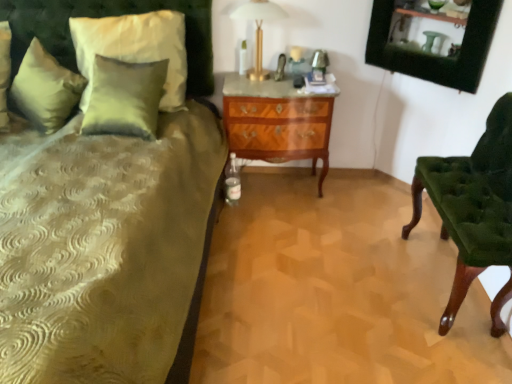
This screenshot has height=384, width=512. Identify the location of velvet green chair at right. (473, 209).

Is point (65, 8) in front of point (288, 110)?

No, it is not.

Considering the relative sizes of velvet green headboard at upper left and mahogany wood drawer at center in the image provided, is velvet green headboard at upper left shorter than mahogany wood drawer at center?

Yes.

Does velvet green headboard at upper left have a lesser width compared to mahogany wood drawer at center?

Correct, the width of velvet green headboard at upper left is less than that of mahogany wood drawer at center.

In the image, there is a velvet green headboard at upper left. Where is `nightstand below it (from the image's perspective)`? This screenshot has width=512, height=384. nightstand below it (from the image's perspective) is located at coordinates (276, 123).

In the image, there is a satin green pillow at upper left, the 2th pillow viewed from the right. Find the location of `chair below it (from a real-world perspective)`. chair below it (from a real-world perspective) is located at coordinates (473, 209).

Is velvet green chair at right outside of satin green pillow at upper left, acting as the first pillow starting from the left?

Yes, velvet green chair at right is outside of satin green pillow at upper left, acting as the first pillow starting from the left.

From the image's perspective, is velvet green chair at right above or below satin green pillow at upper left, the 2th pillow viewed from the right?

Clearly, from the image's perspective, velvet green chair at right is below satin green pillow at upper left, the 2th pillow viewed from the right.

In terms of height, does velvet green chair at right look taller or shorter compared to satin green pillow at upper left, acting as the first pillow starting from the left?

Clearly, velvet green chair at right is taller compared to satin green pillow at upper left, acting as the first pillow starting from the left.

Locate an element on the screen. The height and width of the screenshot is (384, 512). the 1st pillow below the gold metallic table lamp at upper center (from the image's perspective) is located at coordinates (45, 89).

Is point (264, 8) positioned in front of point (20, 108)?

No.

Can you confirm if gold metallic table lamp at upper center is taller than satin green pillow at upper left, acting as the first pillow starting from the left?

Indeed, gold metallic table lamp at upper center has a greater height compared to satin green pillow at upper left, acting as the first pillow starting from the left.

Considering the positions of objects gold metallic table lamp at upper center and satin green pillow at upper left, the 2th pillow viewed from the right, in the image provided, who is behind, gold metallic table lamp at upper center or satin green pillow at upper left, the 2th pillow viewed from the right,?

gold metallic table lamp at upper center is behind.

Is satin green pillow at upper left, acting as the first pillow starting from the left, in contact with gold metallic table lamp at upper center?

satin green pillow at upper left, acting as the first pillow starting from the left, is not next to gold metallic table lamp at upper center, and they're not touching.

Between satin green pillow at upper left, the 2th pillow viewed from the right, and gold metallic table lamp at upper center, which one has smaller size?

gold metallic table lamp at upper center.

From a real-world perspective, is satin green pillow at upper left, the 2th pillow viewed from the right, physically located above or below gold metallic table lamp at upper center?

In terms of real-world spatial position, satin green pillow at upper left, the 2th pillow viewed from the right, is below gold metallic table lamp at upper center.

Is satin green pillow at upper left, acting as the first pillow starting from the left, positioned beyond the bounds of gold metallic table lamp at upper center?

That's correct, satin green pillow at upper left, acting as the first pillow starting from the left, is outside of gold metallic table lamp at upper center.

From a real-world perspective, is gold metallic table lamp at upper center located higher than satin green pillow at upper left, the 1th pillow when ordered from right to left?

Correct, in the physical world, gold metallic table lamp at upper center is higher than satin green pillow at upper left, the 1th pillow when ordered from right to left.

Is point (255, 53) positioned in front of point (153, 42)?

No, it is behind (153, 42).

Between gold metallic table lamp at upper center and satin green pillow at upper left, placed as the second pillow when sorted from left to right, which one has larger width?

gold metallic table lamp at upper center.

Is gold metallic table lamp at upper center outside of satin green pillow at upper left, the 1th pillow when ordered from right to left?

gold metallic table lamp at upper center is positioned outside satin green pillow at upper left, the 1th pillow when ordered from right to left.

From the image's perspective, would you say mahogany wood drawer at center is positioned over velvet green chair at right?

Correct, mahogany wood drawer at center appears higher than velvet green chair at right in the image.

Considering the relative sizes of mahogany wood drawer at center and velvet green chair at right in the image provided, is mahogany wood drawer at center thinner than velvet green chair at right?

No.

Would you say mahogany wood drawer at center is to the left or to the right of velvet green chair at right in the picture?

In the image, mahogany wood drawer at center appears on the left side of velvet green chair at right.

Relative to velvet green chair at right, is mahogany wood drawer at center in front or behind?

Visually, mahogany wood drawer at center is located behind velvet green chair at right.

Considering the points (15, 73) and (38, 46), which point is in front, point (15, 73) or point (38, 46)?

The point (38, 46) is closer to the camera.

Would you say velvet green headboard at upper left contains satin green pillow at upper left, acting as the first pillow starting from the left?

No, satin green pillow at upper left, acting as the first pillow starting from the left, is not surrounded by velvet green headboard at upper left.

Is velvet green headboard at upper left aimed at satin green pillow at upper left, the 2th pillow viewed from the right?

No, velvet green headboard at upper left is not aimed at satin green pillow at upper left, the 2th pillow viewed from the right.

In the scene shown: From the image's perspective, which one is positioned higher, velvet green headboard at upper left or satin green pillow at upper left, acting as the first pillow starting from the left?

From the image's view, velvet green headboard at upper left is above.

The image size is (512, 384). In the image, there is a velvet green headboard at upper left. Find the location of `nightstand below it (from a real-world perspective)`. nightstand below it (from a real-world perspective) is located at coordinates (276, 123).

Starting from the velvet green chair at right, which pillow is the 2nd one to the left? Please provide its 2D coordinates.

[(45, 89)]

Looking at the image, which one is located closer to gold metallic table lamp at upper center, velvet green chair at right or satin green pillow at upper left, the 1th pillow when ordered from right to left?

satin green pillow at upper left, the 1th pillow when ordered from right to left, is closer to gold metallic table lamp at upper center.

Looking at the image, which one is located further to velvet green chair at right, mahogany wood drawer at center or satin green pillow at upper left, acting as the first pillow starting from the left?

satin green pillow at upper left, acting as the first pillow starting from the left, lies further to velvet green chair at right than the other object.

Which object lies nearer to the anchor point velvet green headboard at upper left, satin green pillow at upper left, the 1th pillow when ordered from right to left, or satin green pillow at upper left, acting as the first pillow starting from the left?

satin green pillow at upper left, the 1th pillow when ordered from right to left, lies closer to velvet green headboard at upper left than the other object.

Considering their positions, is velvet green chair at right positioned further to satin green pillow at upper left, acting as the first pillow starting from the left, than velvet green headboard at upper left?

Among the two, velvet green chair at right is located further to satin green pillow at upper left, acting as the first pillow starting from the left.

When comparing their distances from velvet green chair at right, does satin green pillow at upper left, placed as the second pillow when sorted from left to right, or gold metallic table lamp at upper center seem further?

satin green pillow at upper left, placed as the second pillow when sorted from left to right, is positioned further to the anchor velvet green chair at right.

From the image, which object appears to be farther from mahogany wood drawer at center, gold metallic table lamp at upper center or velvet green chair at right?

velvet green chair at right is positioned further to the anchor mahogany wood drawer at center.

When comparing their distances from velvet green headboard at upper left, does velvet green chair at right or satin green pillow at upper left, acting as the first pillow starting from the left, seem closer?

satin green pillow at upper left, acting as the first pillow starting from the left, lies closer to velvet green headboard at upper left than the other object.

Estimate the real-world distances between objects in this image. Which object is further from velvet green headboard at upper left, gold metallic table lamp at upper center or velvet green chair at right?

velvet green chair at right lies further to velvet green headboard at upper left than the other object.

Identify the location of headboard between satin green pillow at upper left, the 2th pillow viewed from the right, and gold metallic table lamp at upper center. [108, 16].

Locate an element on the screen. pillow situated between satin green pillow at upper left, acting as the first pillow starting from the left, and mahogany wood drawer at center from left to right is located at coordinates (135, 48).

The width and height of the screenshot is (512, 384). In order to click on table lamp between satin green pillow at upper left, placed as the second pillow when sorted from left to right, and mahogany wood drawer at center from left to right in this screenshot , I will do `click(259, 29)`.

Where is `table lamp between satin green pillow at upper left, the 1th pillow when ordered from right to left, and velvet green chair at right from left to right`? The image size is (512, 384). table lamp between satin green pillow at upper left, the 1th pillow when ordered from right to left, and velvet green chair at right from left to right is located at coordinates (259, 29).